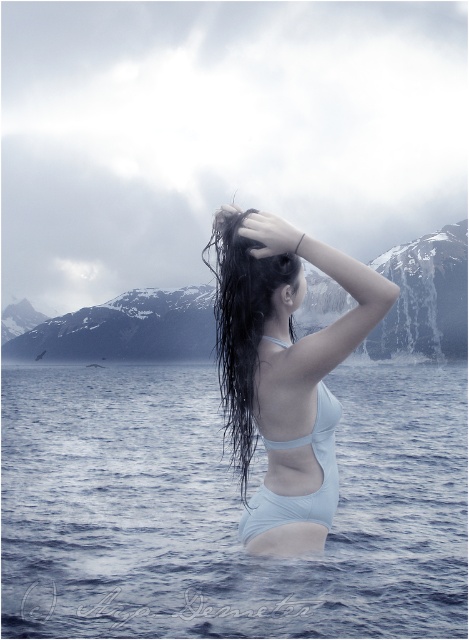
You are a photographer planning to capture a wide shot of the scene. The blue water at center and the white matte bikini at center are crucial elements. Given the distance between them, will you need to adjust your camera settings to ensure both are in focus simultaneously?

The distance between the blue water at center and the white matte bikini at center is 112.69 meters. To ensure both are in focus, you should use a smaller aperture setting to increase the depth of field, allowing both foreground and background elements to be sharp.